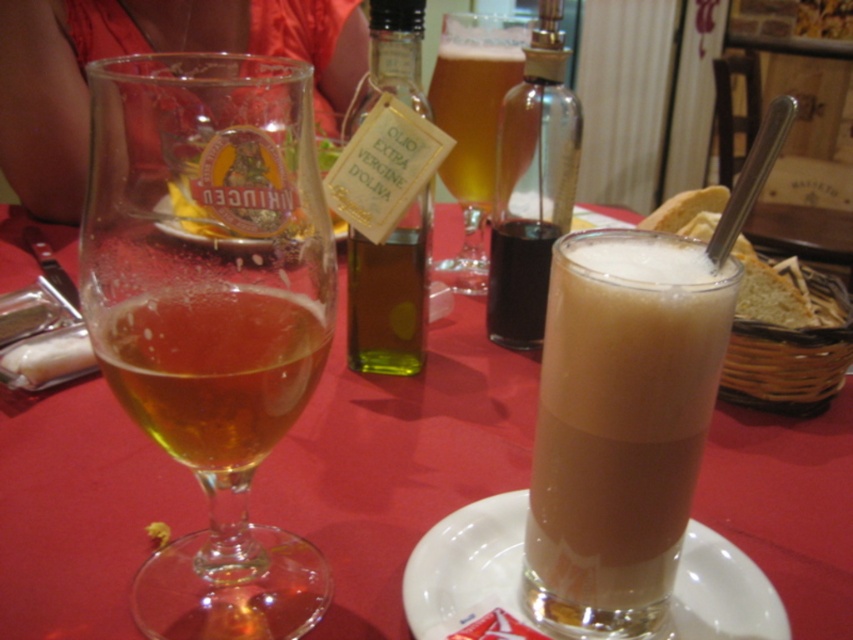
You are a waiter at a restaurant and need to place a new order on the table. The order includes a bottle of wine and a beer. The table already has the dark brown glass bottle at center and the translucent glass beer at center. Where should you place the new items to maintain the existing arrangement?

The dark brown glass bottle at center is located below the translucent glass beer at center. To maintain the existing arrangement, place the new bottle of wine below the existing dark brown glass bottle and the new beer above the translucent glass beer at center.

You are a customer at this restaurant and want to choose the taller item between the brown frothy liquid at center and the green glass bottle at center. Which one should you choose?

The green glass bottle at center is taller than the brown frothy liquid at center, so you should choose the green glass bottle at center.

You are sitting at the dining table and want to reach for the item located at point (82, 246) and the item at point (489, 291). Which item is closer to you?

The item at point (82, 246) is closer to you because it is in front of the item at point (489, 291).